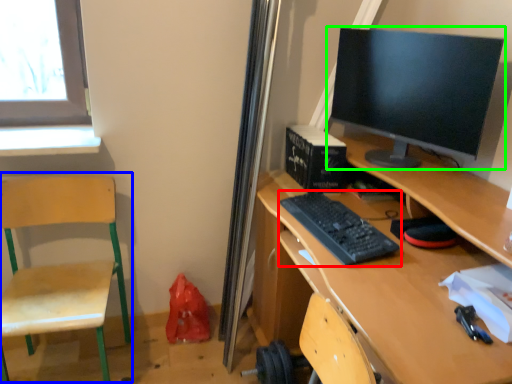
Question: Estimate the real-world distances between objects in this image. Which object is farther from computer keyboard (highlighted by a red box), swivel chair (highlighted by a blue box) or computer monitor (highlighted by a green box)?

Choices:
 (A) swivel chair
 (B) computer monitor

Answer: (A)